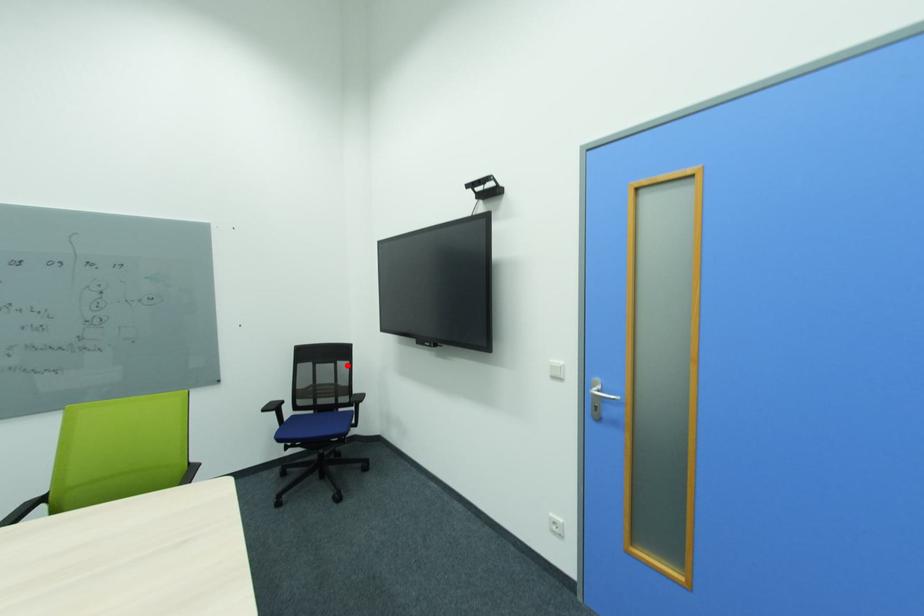
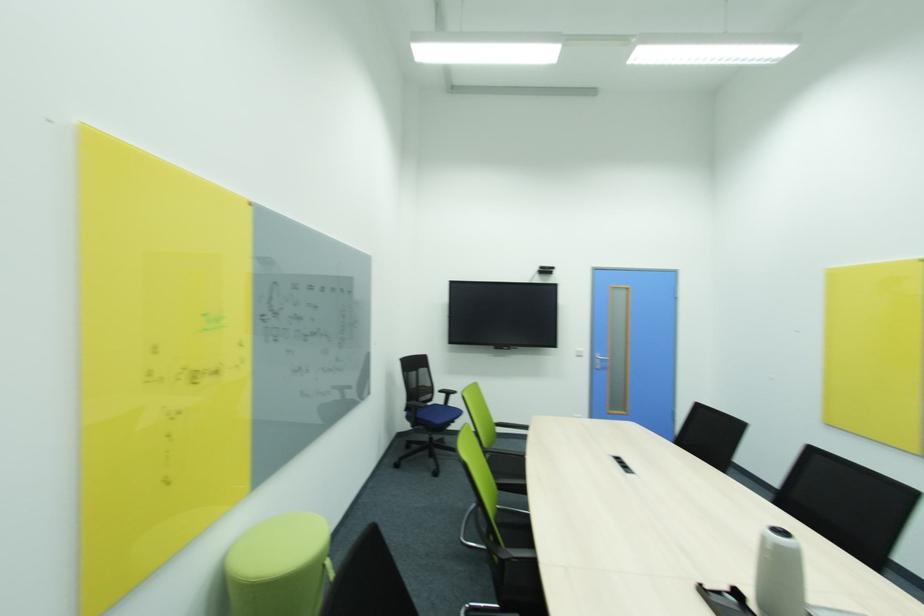
Question: I am providing you with two images of the same scene from different viewpoints. A red point is marked on the first image. Can you still see the location of the red point in image 2?

Choices:
 (A) Yes
 (B) No

Answer: (A)